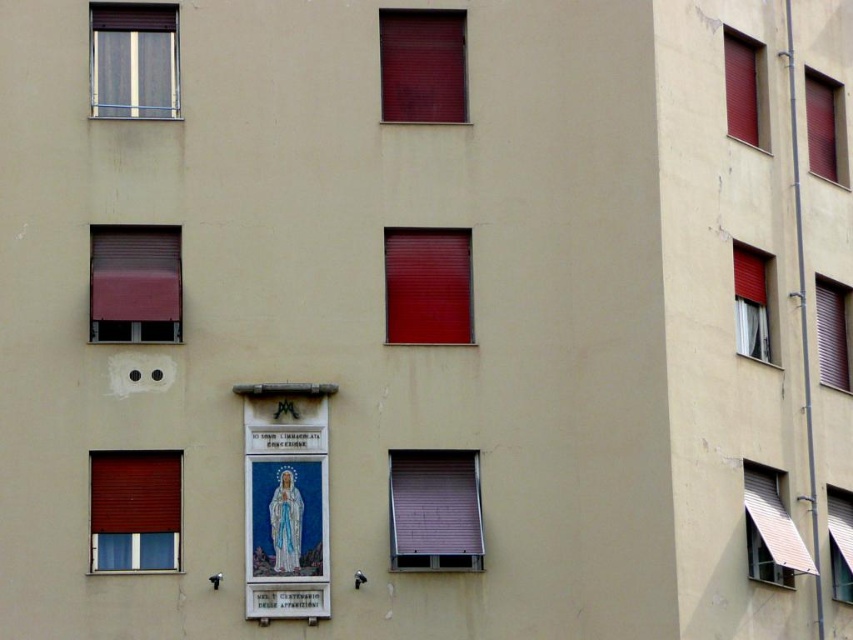
You are a painter hired to paint the windows of this building. You have a ladder that can reach up to 2 meters. The matte red roller at lower left and the matte red window at center are both at different heights. Which window should you choose to paint first if you want to start with the one that is easier to reach with your ladder?

The matte red roller at lower left is easier to reach because it is positioned lower than the matte red window at center, so you should start with the matte red roller at lower left.

What is the 2D coordinate of the matte red roller at lower left?

The 2D coordinate of the matte red roller at lower left is at point (134,509).

You are a photographer standing at a certain point wanting to capture the framed religious artwork on the residential building wall. You have a camera with a 50mm lens. Considering the matte red roller at lower left is 56.17 meters away from you, can you estimate if the framed religious artwork is within the same focal length range to be captured clearly in the same shot?

The matte red roller at lower left is 56.17 meters away from the camera. Since both the matte red roller at lower left and the framed religious artwork are on the same wall, the framed religious artwork would also be approximately 56.17 meters away. A 50mm lens has a standard field of view and can capture subjects at that distance clearly if they are within the camera frame. Therefore, the framed religious artwork should be within the same focal length range and can be captured clearly in the same shot.